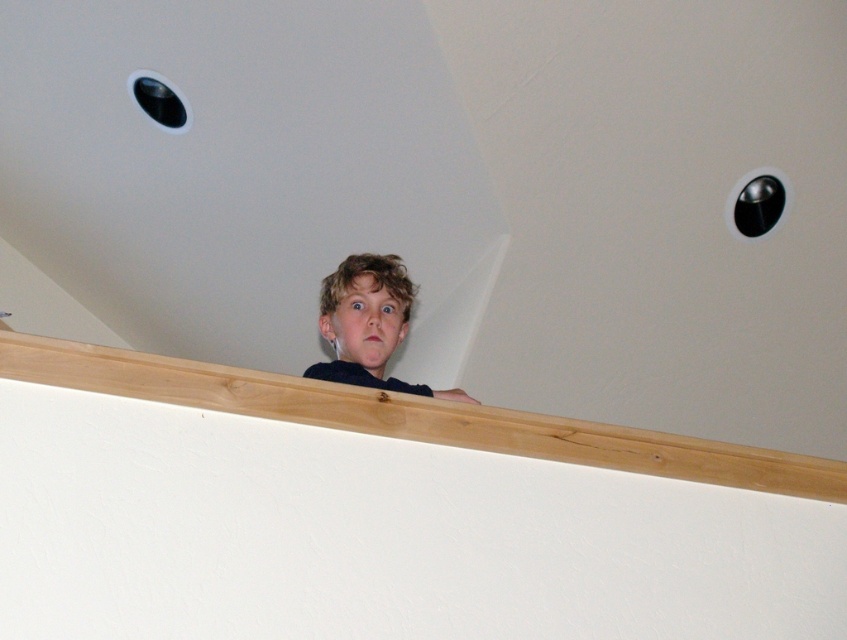
You are a photographer standing at the camera position. The boy is at the light brown wood at upper center. You need to move closer to the boy by 1 meter. How far will you be from the boy after moving?

The light brown wood at upper center and camera are 2.08 meters apart. Moving 1 meter closer reduces the distance to 1.08 meters, so you will be 1.08 meters away from the boy.